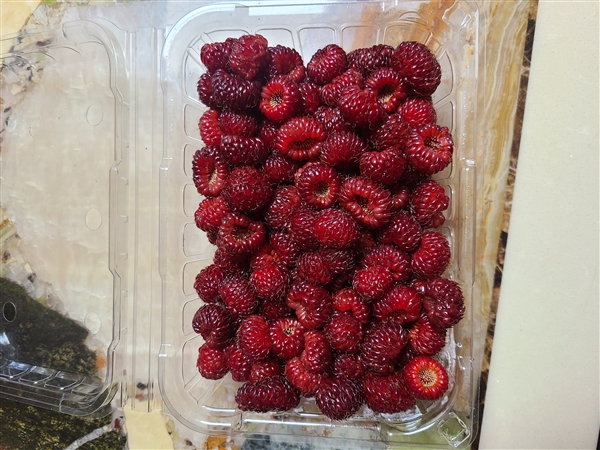
You are a GUI agent. You are given a task and a screenshot of the screen. Output one action in this format:
    pyautogui.click(x=<x>, y=<y>)
    Task: Click on the plastic container
    The height and width of the screenshot is (450, 600).
    Given the screenshot: What is the action you would take?
    pyautogui.click(x=168, y=311)